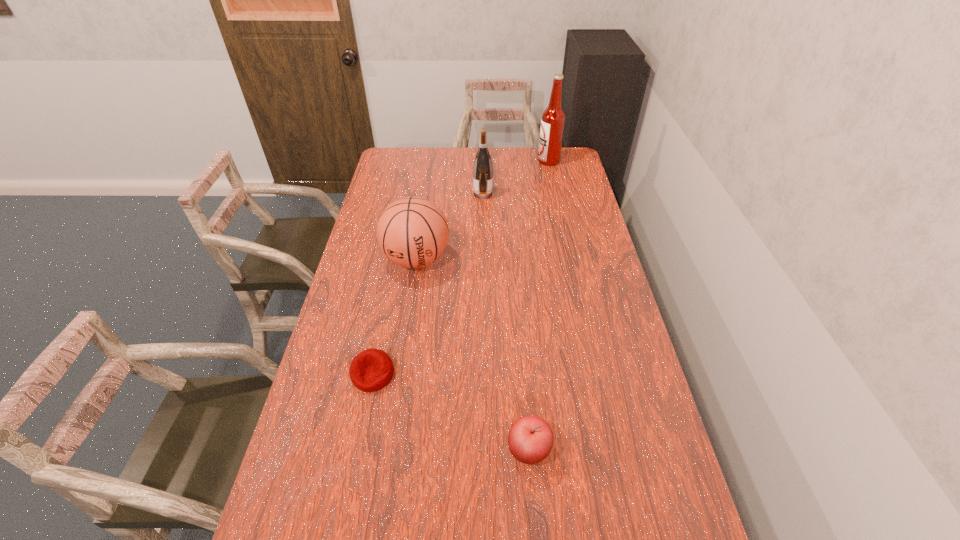
Where is `vacant area located 0.240m on the label side of the tallest object`? vacant area located 0.240m on the label side of the tallest object is located at coordinates (488, 161).

Where is `free location located on the label side of the tallest object`? free location located on the label side of the tallest object is located at coordinates (504, 161).

This screenshot has height=540, width=960. Identify the location of free space located on the label side of the tallest object. (454, 161).

You are a GUI agent. You are given a task and a screenshot of the screen. Output one action in this format:
    pyautogui.click(x=<x>, y=<y>)
    Task: Click on the vacant position located 0.340m on the label of the second farthest object
    
    Given the screenshot: What is the action you would take?
    pyautogui.click(x=396, y=194)

Where is `vacant area situated on the label of the second farthest object`? The image size is (960, 540). vacant area situated on the label of the second farthest object is located at coordinates (434, 194).

At what (x,y) coordinates should I click in order to perform the action: click on free space located on the label of the second farthest object. Please return your answer as a coordinate pair (x, y). Looking at the image, I should click on (402, 194).

Find the location of a particular element. The width and height of the screenshot is (960, 540). blank space located 0.100m on the surface of the third farthest object near the brand logo is located at coordinates (410, 305).

Identify the location of vacant area located 0.170m on the left of the second shortest object. (439, 450).

Locate an element on the screen. This screenshot has width=960, height=540. vacant space located on the seat area of the beanbag is located at coordinates (362, 427).

The image size is (960, 540). Identify the location of object at the far edge. (553, 118).